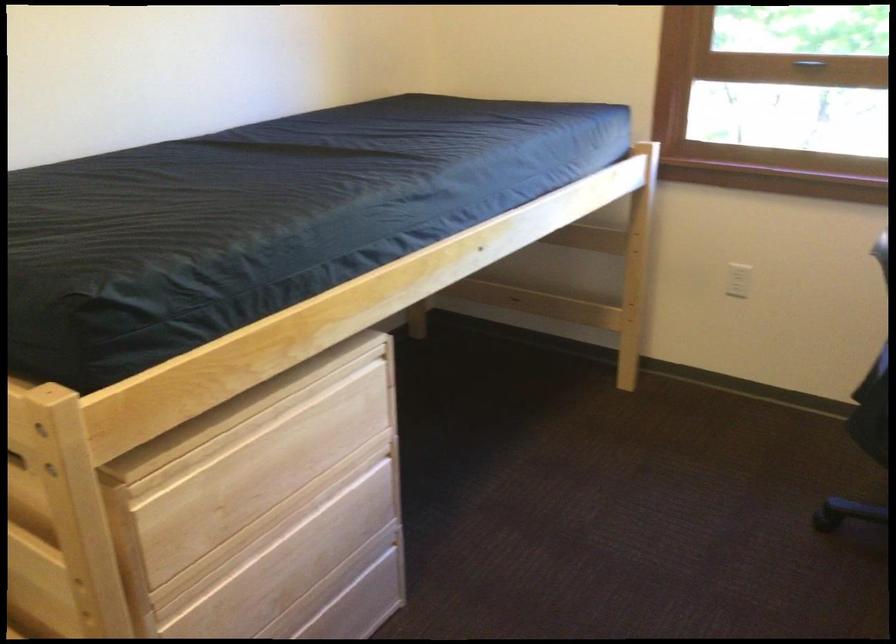
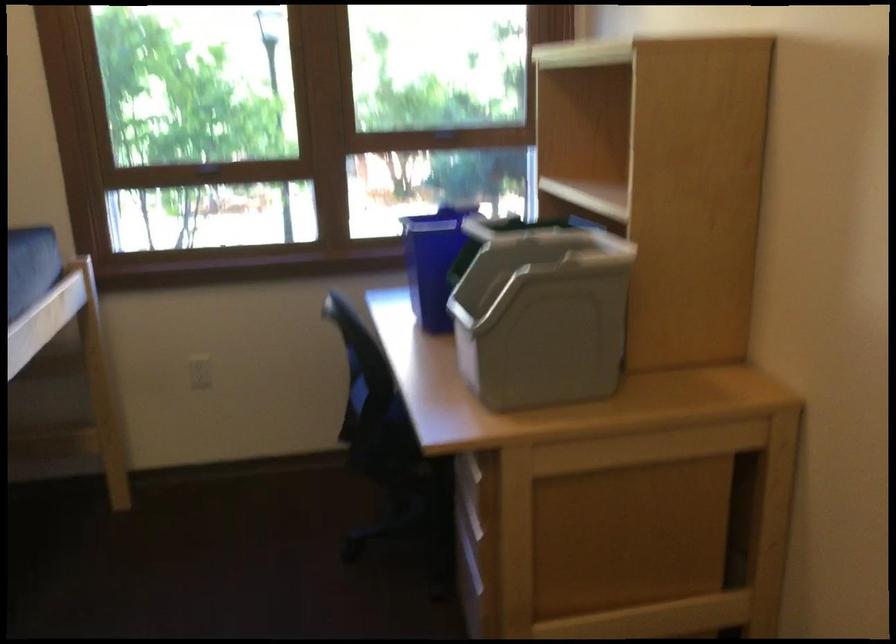
The point at (731, 279) is marked in the first image. Where is the corresponding point in the second image?

(200, 372)